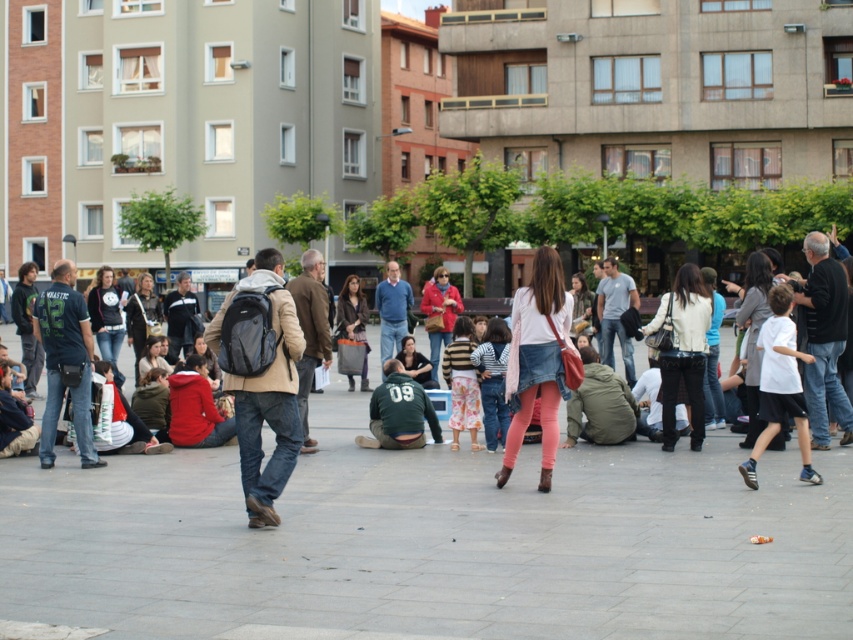
Consider the image. You are a photographer planning to take a group photo of the denim skirt at center and the white cotton shirt at right. Based on their heights, which person should stand in the back to avoid blocking the view?

The denim skirt at center is much taller than the white cotton shirt at right, so the person wearing the denim skirt at center should stand in the back to avoid blocking the view.